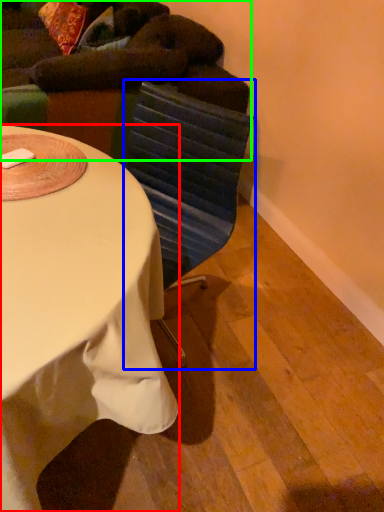
Question: Based on their relative distances, which object is nearer to desk (highlighted by a red box)? Choose from swivel chair (highlighted by a blue box) and bean bag chair (highlighted by a green box).

Choices:
 (A) swivel chair
 (B) bean bag chair

Answer: (A)